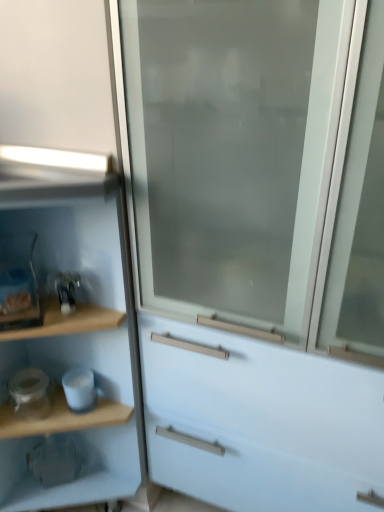
Question: From their relative heights in the image, would you say wooden shelf at left is taller or shorter than frosted glass screen door at center?

Choices:
 (A) tall
 (B) short

Answer: (B)

Question: Considering the relative positions of wooden shelf at left and frosted glass screen door at center in the image provided, is wooden shelf at left to the left or to the right of frosted glass screen door at center?

Choices:
 (A) left
 (B) right

Answer: (A)

Question: Which object is positioned closest to the white glossy jar at lower left, which is counted as the 2th appliance, starting from the right?

Choices:
 (A) wooden shelf at left
 (B) frosted glass screen door at center
 (C) white glossy mug at lower left, which appears as the second appliance when viewed from the left

Answer: (C)

Question: Which object is positioned farthest from the white glossy mug at lower left, which appears as the second appliance when viewed from the left?

Choices:
 (A) frosted glass screen door at center
 (B) white glossy jar at lower left, which is counted as the 2th appliance, starting from the right
 (C) wooden shelf at left

Answer: (A)